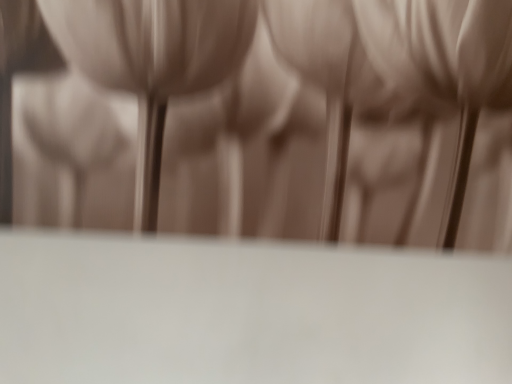
This screenshot has height=384, width=512. What do you see at coordinates (395, 87) in the screenshot? I see `matte glass vase at center` at bounding box center [395, 87].

Identify the location of matte glass vase at center. The image size is (512, 384). (395, 87).

Where is `matte glass vase at center`? This screenshot has height=384, width=512. matte glass vase at center is located at coordinates (395, 87).